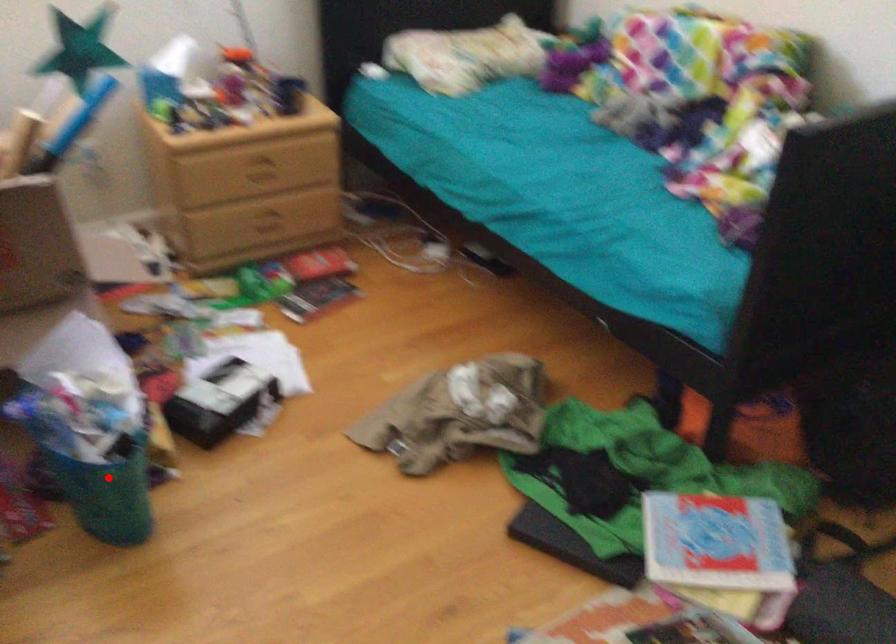
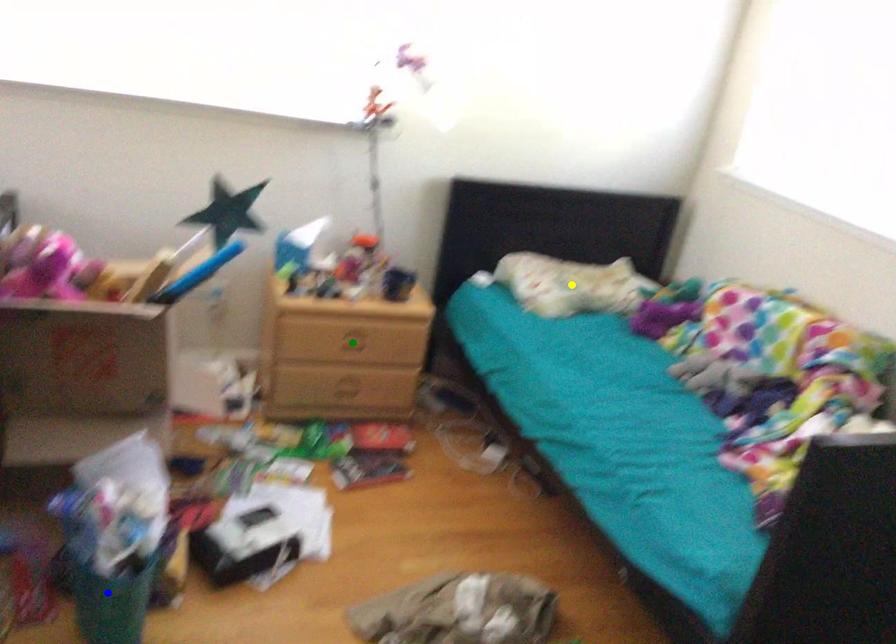
Question: I am providing you with two images of the same scene from different viewpoints. A red point is marked on the first image. You are given multiple points on the second image. Can you choose the point in image 2 that corresponds to the point in image 1?

Choices:
 (A) blue point
 (B) green point
 (C) yellow point

Answer: (A)